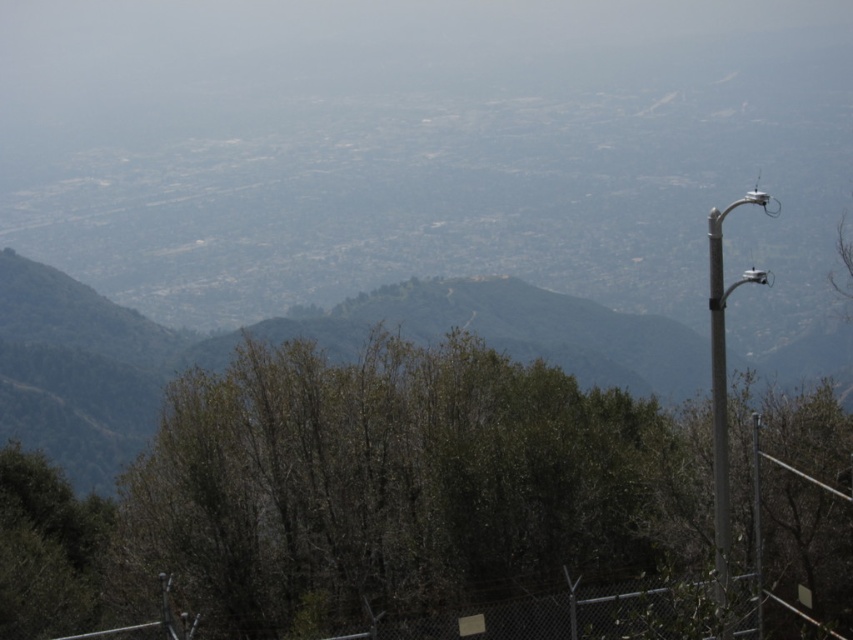
Question: Can you confirm if green leafy tree at center is smaller than metallic chain-link fence at lower center?

Choices:
 (A) yes
 (B) no

Answer: (B)

Question: Can you confirm if green leafy tree at center is smaller than metallic chain-link fence at lower center?

Choices:
 (A) no
 (B) yes

Answer: (A)

Question: Is green leafy tree at center behind metallic chain-link fence at lower center?

Choices:
 (A) no
 (B) yes

Answer: (B)

Question: Among these objects, which one is farthest from the camera?

Choices:
 (A) green leafy tree at center
 (B) metallic chain-link fence at lower center

Answer: (A)

Question: Which point is closer to the camera?

Choices:
 (A) green leafy tree at center
 (B) metallic chain-link fence at lower center

Answer: (B)

Question: Which point is farther to the camera?

Choices:
 (A) metallic chain-link fence at lower center
 (B) green leafy tree at center

Answer: (B)